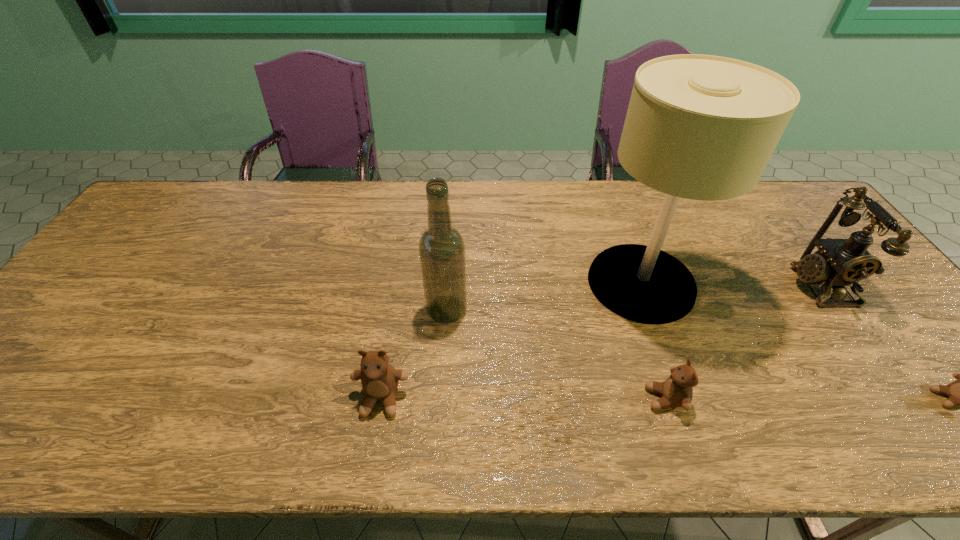
Identify the location of vacant region located on the front-facing side of the fifth tallest object. (524, 399).

I want to click on vacant space located on the left of the fifth object from right to left, so click(319, 310).

Where is `free space located 0.050m on the left of the table lamp`? free space located 0.050m on the left of the table lamp is located at coordinates (570, 283).

Identify the location of free location located on the rotary dial of the fourth shortest object. (736, 285).

Where is `vacant area located on the rotary dial of the fourth shortest object`? This screenshot has width=960, height=540. vacant area located on the rotary dial of the fourth shortest object is located at coordinates (700, 285).

Locate an element on the screen. vacant point located 0.250m on the rotary dial of the fourth shortest object is located at coordinates (700, 285).

The height and width of the screenshot is (540, 960). What are the coordinates of `object that is positioned at the right edge` in the screenshot? It's located at (838, 262).

The image size is (960, 540). Identify the location of blank space at the far edge of the desktop. (384, 191).

Find the location of a particular element. vacant space at the near edge is located at coordinates (597, 370).

The image size is (960, 540). In the image, there is a desktop. Find the location of `vacant space at the left edge`. vacant space at the left edge is located at coordinates (59, 319).